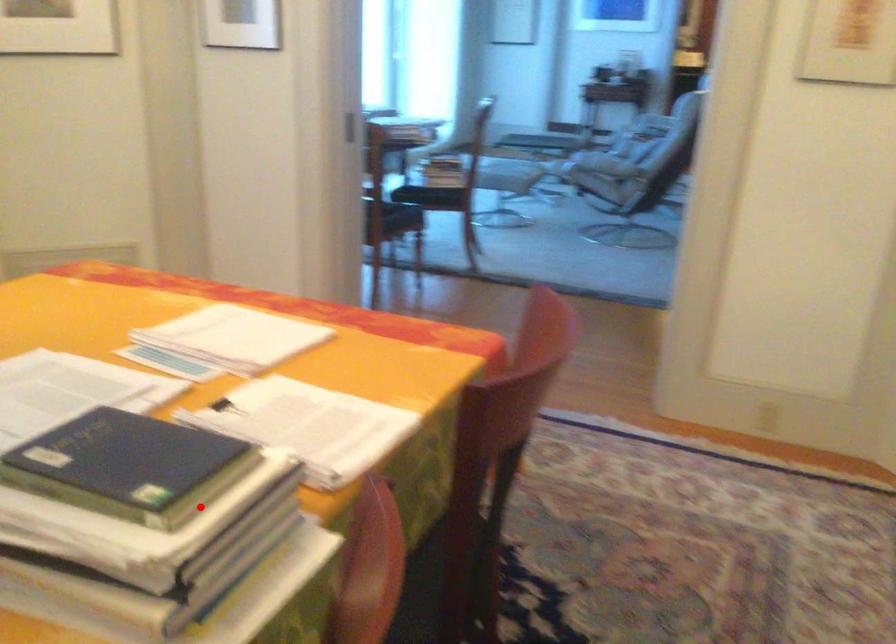
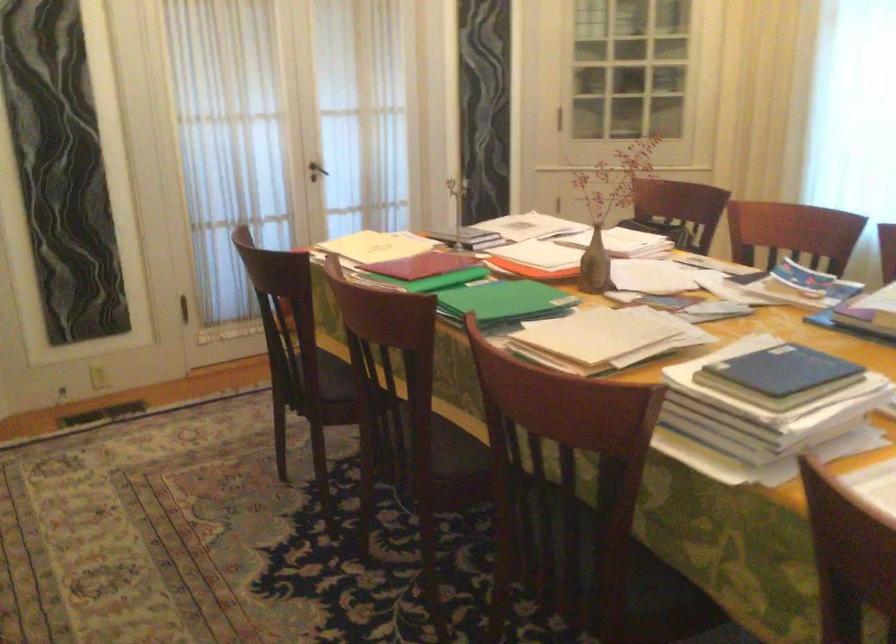
Question: I am providing you with two images of the same scene from different viewpoints. Given a red point in image1, look at the same physical point in image2. Is it:

Choices:
 (A) Closer to the viewpoint
 (B) Farther from the viewpoint

Answer: (B)